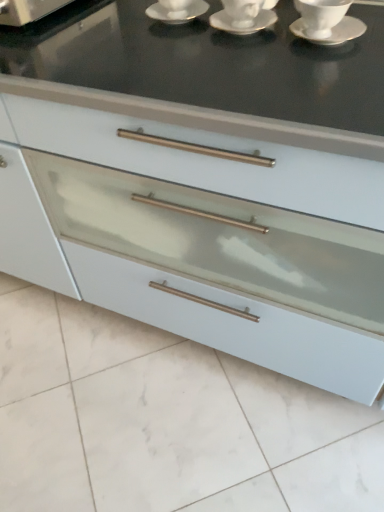
Question: Is white ceramic saucer at center, the second saucer when ordered from right to left, taller or shorter than white ceramic saucer at upper center, which is the third saucer from right to left?

Choices:
 (A) tall
 (B) short

Answer: (B)

Question: Considering the relative positions of white ceramic saucer at center, the second saucer when ordered from right to left, and white ceramic saucer at upper center, the 1th saucer from the left, in the image provided, is white ceramic saucer at center, the second saucer when ordered from right to left, to the left or to the right of white ceramic saucer at upper center, the 1th saucer from the left,?

Choices:
 (A) left
 (B) right

Answer: (B)

Question: Which object is positioned farthest from the white ceramic saucer at center, the second saucer when ordered from right to left?

Choices:
 (A) white ceramic cup at upper right
 (B) white ceramic saucer at upper center, which is the third saucer from right to left
 (C) white glossy saucer at upper right, which ranks as the first saucer in right-to-left order

Answer: (C)

Question: Which of these objects is positioned closest to the white ceramic saucer at upper center, which is the third saucer from right to left?

Choices:
 (A) white ceramic cup at upper right
 (B) white glossy saucer at upper right, which ranks as the first saucer in right-to-left order
 (C) white ceramic saucer at center, the second saucer when ordered from right to left

Answer: (C)